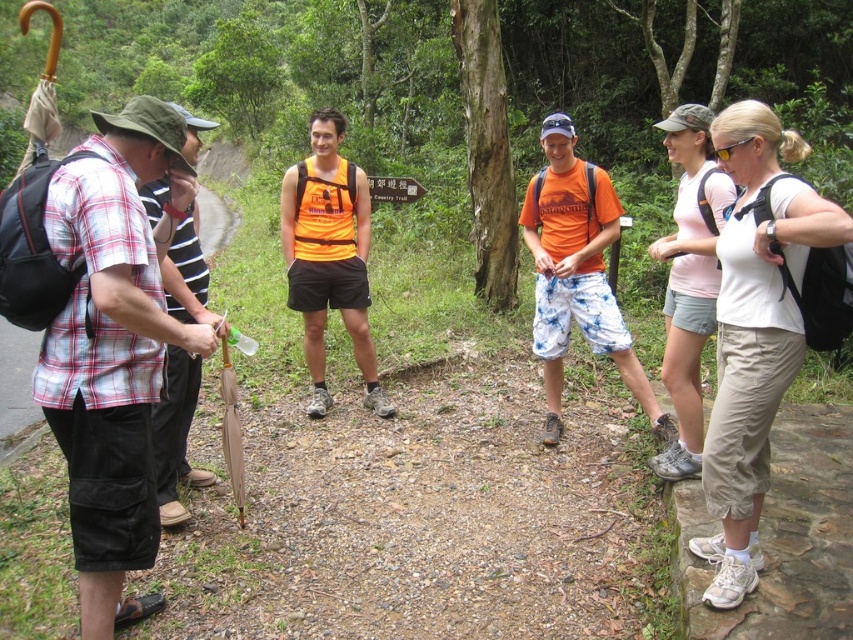
You are a hiker trying to navigate through the forest. You see two landmarks marked as point 1 at coordinates (801, 234) and point 2 at coordinates (350, 241). If you are facing the direction of the forest path, which point is closer to you?

Point 1 at coordinates (801, 234) is in front of point 2 at coordinates (350, 241), so it is closer to you.

You are a photographer trying to capture a photo of the orange matte vest at center without including the plaid cotton shirt at left in the frame. Based on their positions, is this possible?

The plaid cotton shirt at left is positioned under the orange matte vest at center, so it might be challenging to capture the orange matte vest at center without including the plaid cotton shirt at left in the frame.

You are standing at point [755,330] in the image. What clothing item are you currently standing on?

The point [755,330] is on light beige capri pants at right.